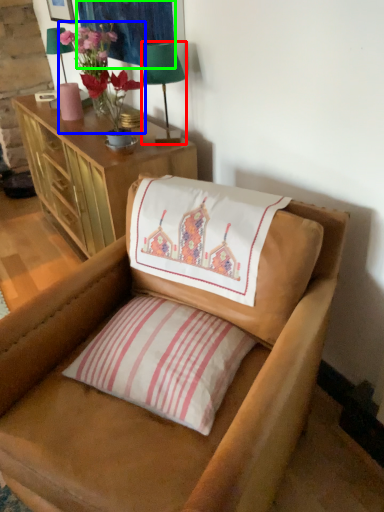
Question: Which object is positioned closest to table lamp (highlighted by a red box)? Select from floral arrangement (highlighted by a blue box) and tapestry (highlighted by a green box).

Choices:
 (A) floral arrangement
 (B) tapestry

Answer: (A)